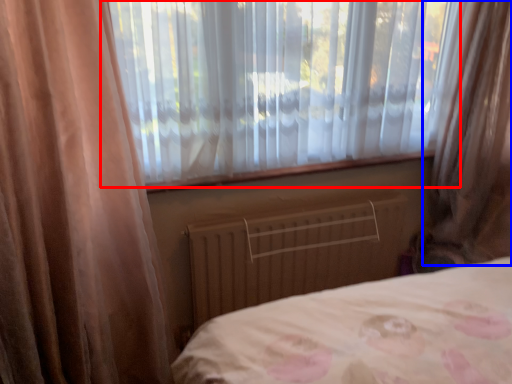
Question: Which of the following is the farthest to the observer, window (highlighted by a red box) or curtain (highlighted by a blue box)?

Choices:
 (A) window
 (B) curtain

Answer: (A)